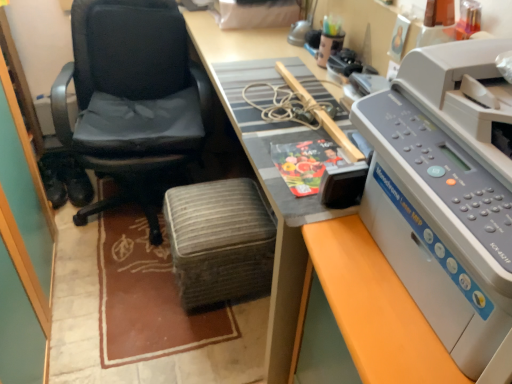
This screenshot has width=512, height=384. What are the coordinates of `vacant area on top of brown woven mat at lower left (from a real-world perspective)` in the screenshot? It's located at coord(127,289).